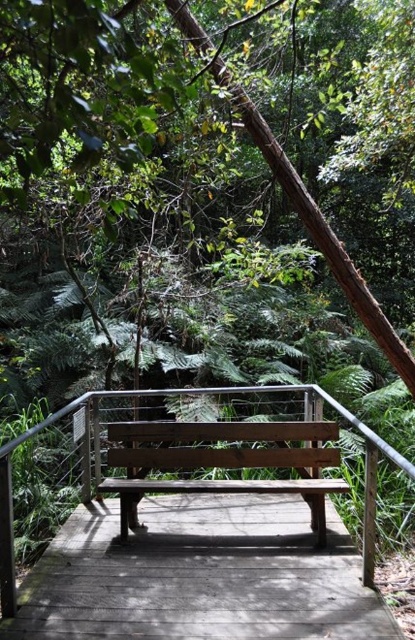
You are standing on a wooden platform in a forest and want to sit on the closest bench. Which bench should you choose between the weathered wood bench at center and the wooden bench at center?

The weathered wood bench at center is closer to the viewer, so you should choose the weathered wood bench at center to sit on.

You are standing on the wooden platform and want to reach the point marked as point (270, 616). If your walking distance is limited to 10 feet, can you comfortably walk to that point without exceeding your limit?

The point (270, 616) is 9.24 feet away from the viewer, so yes, you can comfortably walk to that point without exceeding your 10 feet limit.